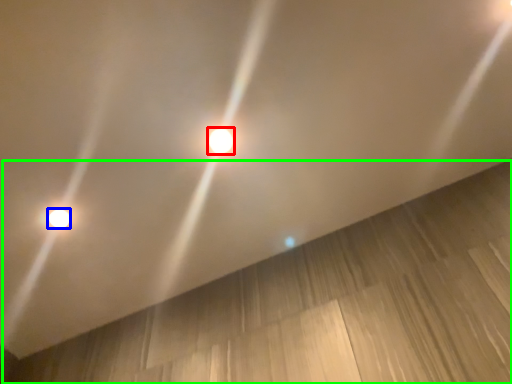
Question: Estimate the real-world distances between objects in this image. Which object is closer to lamp (highlighted by a red box), lamp (highlighted by a blue box) or plywood (highlighted by a green box)?

Choices:
 (A) lamp
 (B) plywood

Answer: (A)